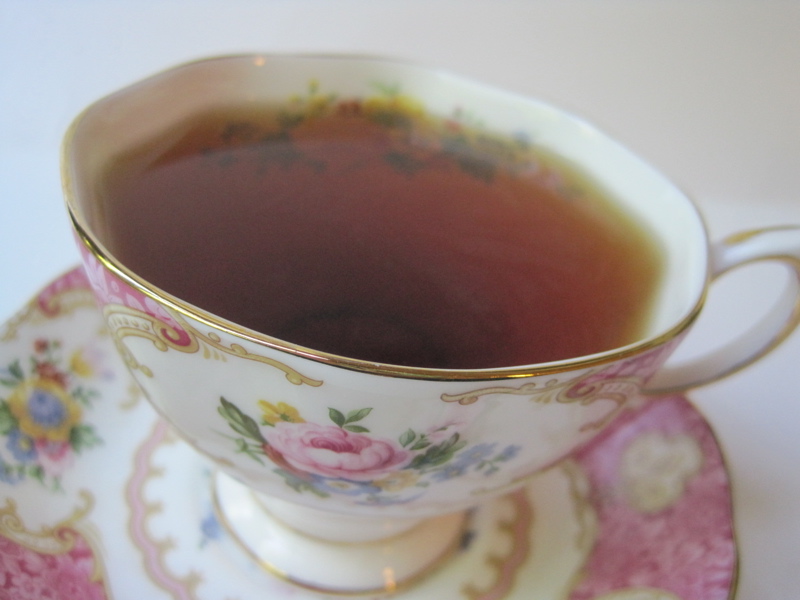
I want to click on saucer, so click(x=112, y=492).